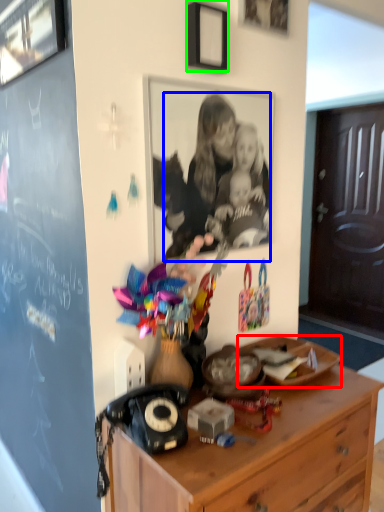
Question: Which is farther away from plate (highlighted by a red box)? person (highlighted by a blue box) or picture frame (highlighted by a green box)?

Choices:
 (A) person
 (B) picture frame

Answer: (B)